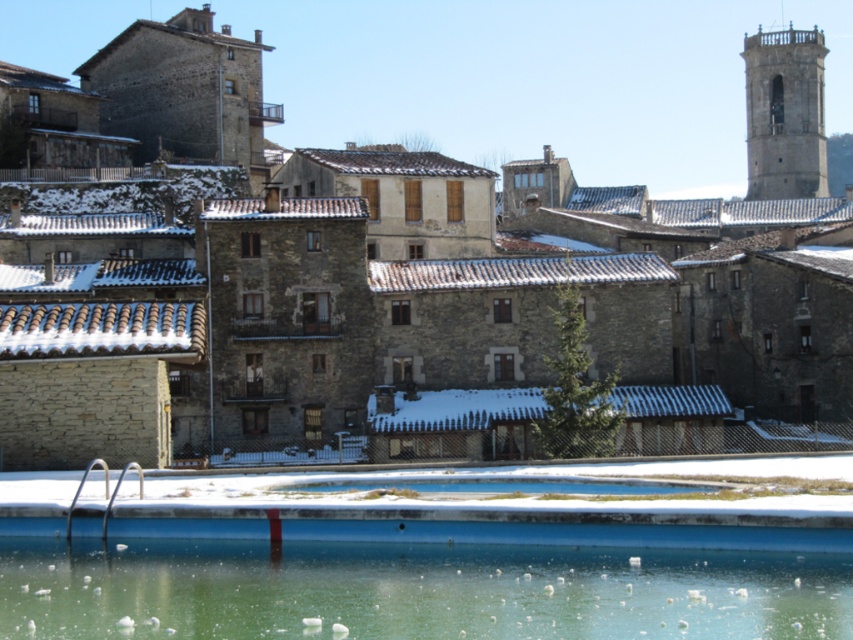
You are standing at the edge of the blue concrete pool at lower center and want to take a photo of the stone buildings at center. Since you want the buildings to be the main focus, should you stand closer to the pool or move further away from it?

The stone buildings at center are located above the blue concrete pool at lower center. To make the buildings the main focus in your photo, you should stand closer to the pool so that the buildings appear larger and more prominent in the frame.

You are a photographer planning to take a photo of the blue concrete pool at lower center and the gray stone tower at upper right. Based on their positions, which object will appear larger in the photo?

The gray stone tower at upper right will appear larger in the photo because it is taller than the blue concrete pool at lower center.